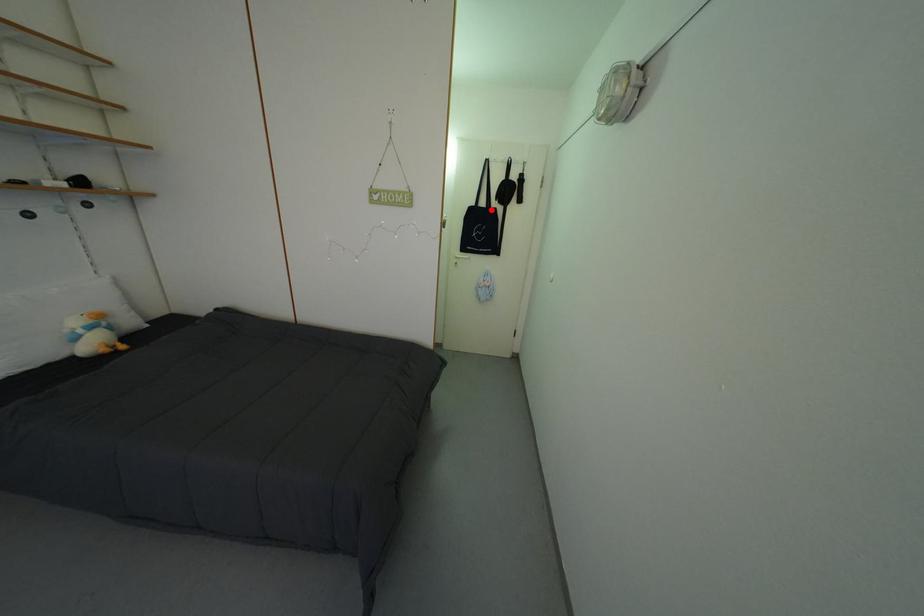
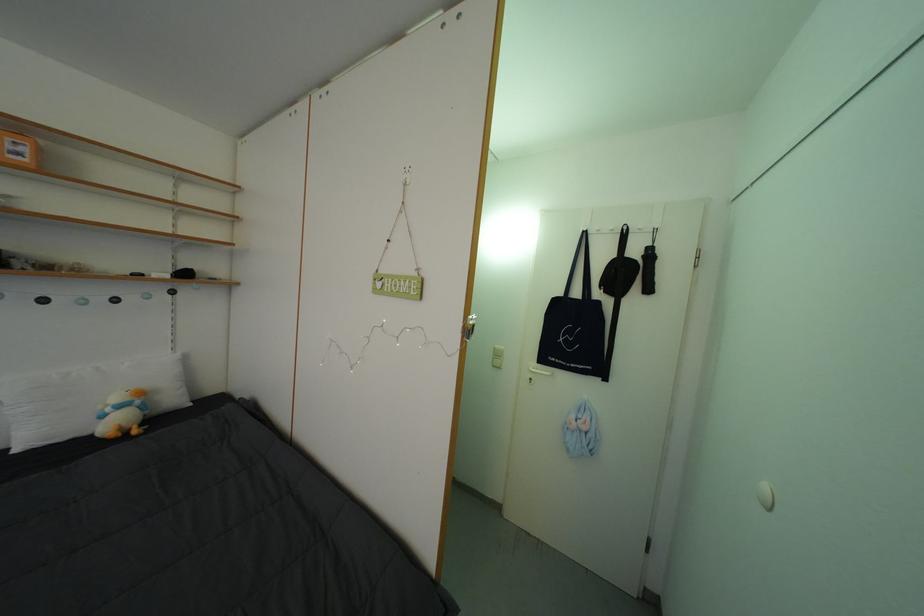
Question: I am providing you with two images of the same scene from different viewpoints. A red point is shown in image1. For the corresponding object point in image2, is it positioned nearer or farther from the camera?

Choices:
 (A) Nearer
 (B) Farther

Answer: (B)